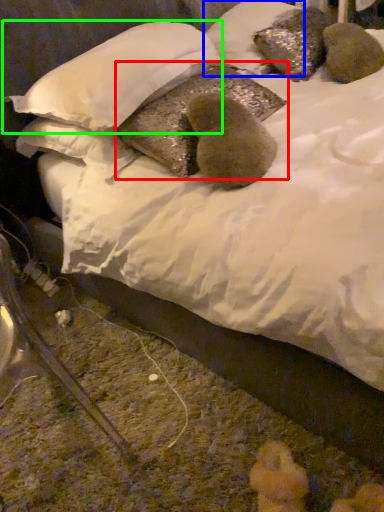
Question: Based on their relative distances, which object is farther from pillow (highlighted by a red box)? Choose from pillow (highlighted by a blue box) and pillow (highlighted by a green box).

Choices:
 (A) pillow
 (B) pillow

Answer: (A)